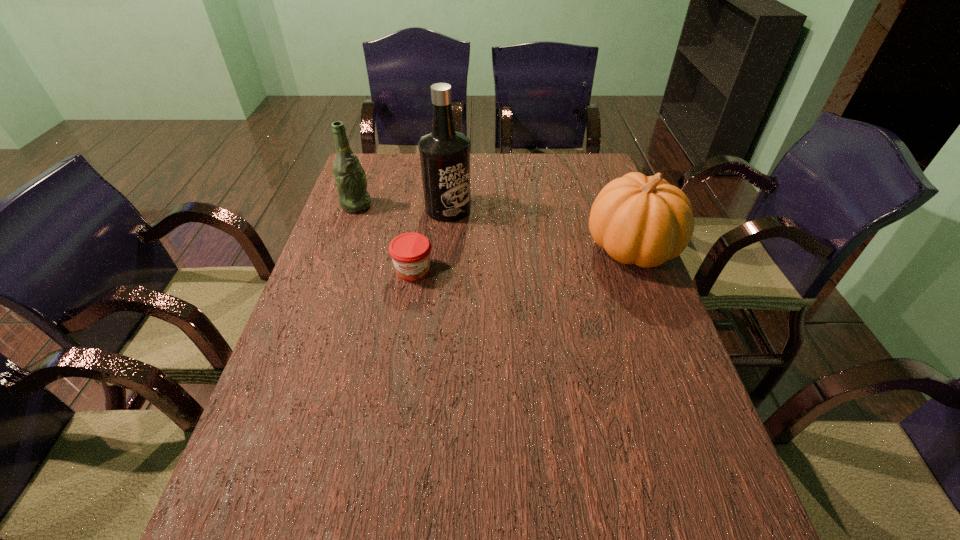
The width and height of the screenshot is (960, 540). In order to click on jam in this screenshot , I will do `click(410, 252)`.

This screenshot has width=960, height=540. I want to click on pumpkin, so click(x=643, y=220).

At what (x,y) coordinates should I click in order to perform the action: click on liquor. Please return your answer as a coordinate pair (x, y). This screenshot has height=540, width=960. Looking at the image, I should click on (444, 153).

Identify the location of beer bottle. This screenshot has height=540, width=960. (350, 177).

At what (x,y) coordinates should I click in order to perform the action: click on vacant area located 0.360m on the label side of the shortest object. Please return your answer as a coordinate pair (x, y). The width and height of the screenshot is (960, 540). Looking at the image, I should click on (392, 407).

Where is `vacant region located on the front of the pumpkin`? The width and height of the screenshot is (960, 540). vacant region located on the front of the pumpkin is located at coordinates (696, 417).

Find the location of a particular element. Image resolution: width=960 pixels, height=540 pixels. free region located 0.390m on the front label of the tallest object is located at coordinates (564, 280).

This screenshot has height=540, width=960. I want to click on blank space located on the front label of the tallest object, so click(475, 226).

At what (x,y) coordinates should I click in order to perform the action: click on free location located on the front label of the tallest object. Please return your answer as a coordinate pair (x, y). The width and height of the screenshot is (960, 540). Looking at the image, I should click on (480, 228).

This screenshot has height=540, width=960. I want to click on vacant space situated 0.090m on the surface of the beer bottle, so click(x=392, y=217).